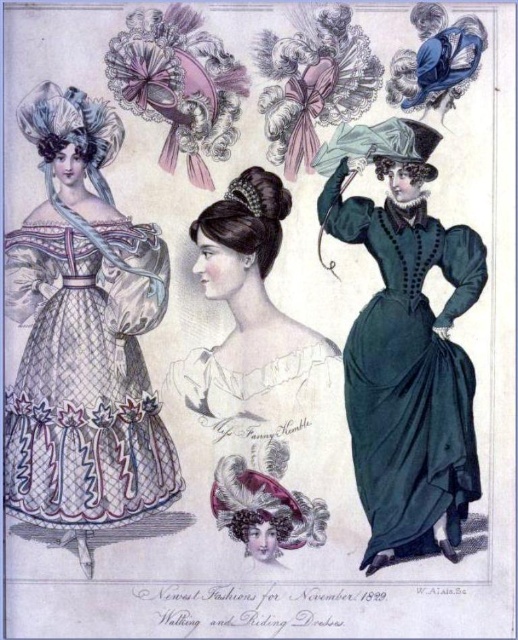
Which is more to the left, white netted dress at left or white lace dress at center?

From the viewer's perspective, white netted dress at left appears more on the left side.

Where is `white netted dress at left`? This screenshot has height=640, width=518. white netted dress at left is located at coordinates (85, 376).

Locate an element on the screen. white netted dress at left is located at coordinates (85, 376).

Can you confirm if velvet green dress at center is positioned to the left of white netted dress at left?

Incorrect, velvet green dress at center is not on the left side of white netted dress at left.

Can you confirm if velvet green dress at center is wider than white netted dress at left?

Incorrect, velvet green dress at center's width does not surpass white netted dress at left's.

Which is behind, point (377, 368) or point (13, 268)?

Positioned behind is point (13, 268).

Where is `velvet green dress at center`? Image resolution: width=518 pixels, height=640 pixels. velvet green dress at center is located at coordinates (406, 346).

Between velvet green dress at center and white lace dress at center, which one has less height?

white lace dress at center

Can you confirm if velvet green dress at center is positioned to the right of white lace dress at center?

Indeed, velvet green dress at center is positioned on the right side of white lace dress at center.

Based on the photo, who is more distant from viewer, (459, 275) or (256, 497)?

Point (459, 275)

I want to click on velvet green dress at center, so click(406, 346).